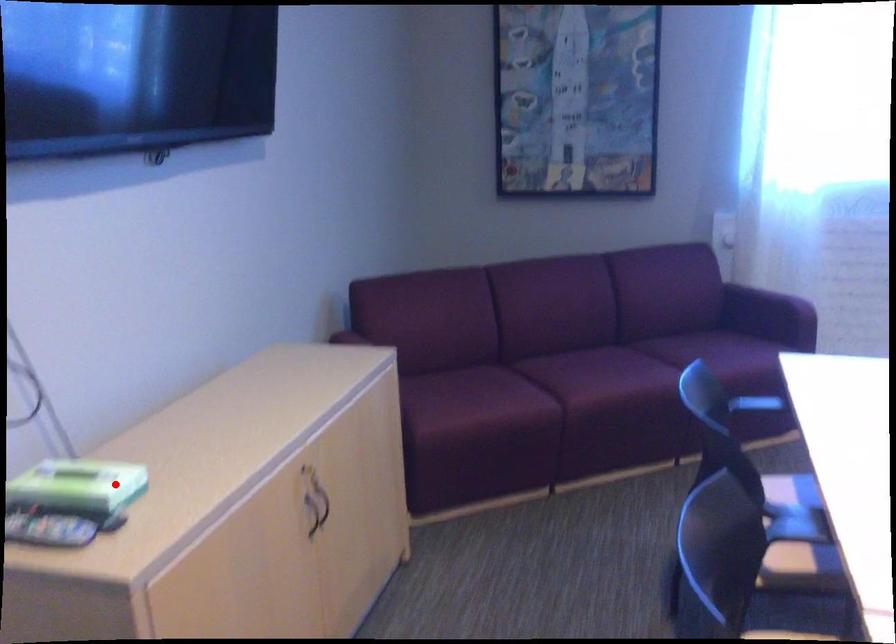
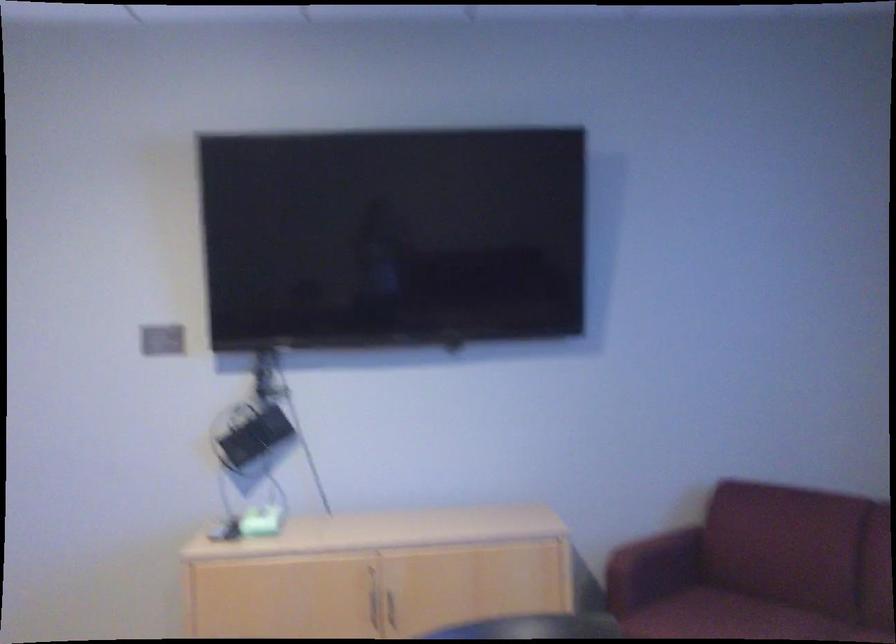
Find the pixel in the second image that matches the highlighted location in the first image.

(257, 522)